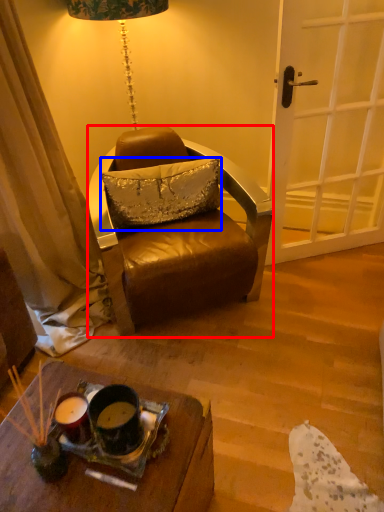
Question: Which point is further to the camera, chair (highlighted by a red box) or pillow (highlighted by a blue box)?

Choices:
 (A) chair
 (B) pillow

Answer: (B)